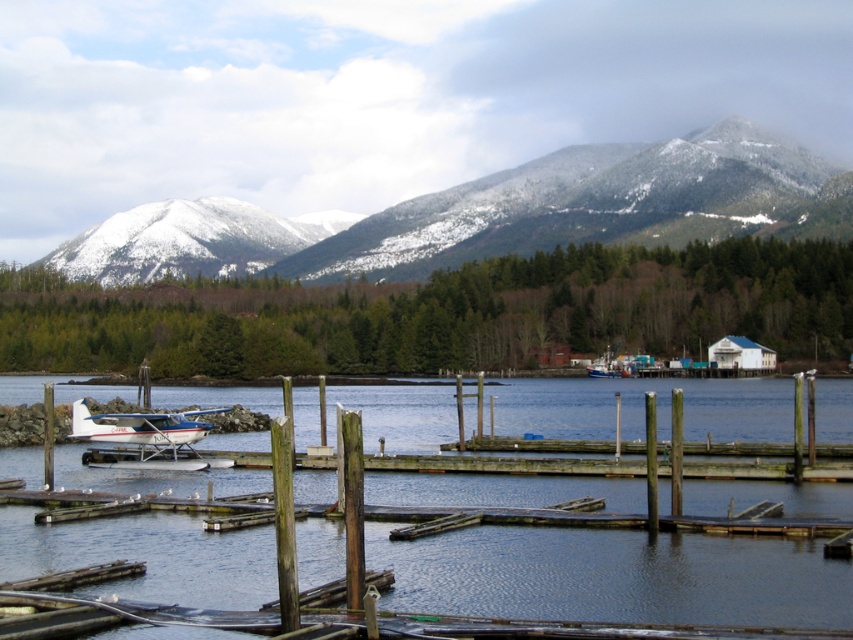
You are standing at the camera position observing the waterfront scene. There is a point marked at coordinates point (142, 220). Can you determine if this point is within a 500 meter radius from your current position?

Point (142, 220) and camera are 451.51 meters apart from each other, so yes, the point is within a 500 meter radius from the camera position.

You are a pilot planning to take off from the dock. The seaplane requires a clear path of at least 10 meters to accelerate. Based on the coordinates of the smooth blue water at center, can you determine if there is enough space for takeoff?

The smooth blue water at center is located at coordinates point (614, 577), but without knowing the scale or distance between coordinates, it is impossible to determine if there is enough space for takeoff.